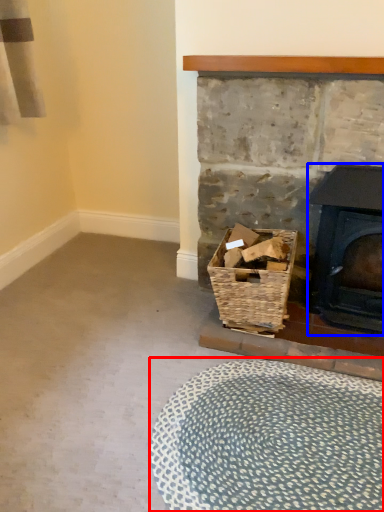
Question: Among these objects, which one is farthest to the camera, plain (highlighted by a red box) or wood burning stove (highlighted by a blue box)?

Choices:
 (A) plain
 (B) wood burning stove

Answer: (B)